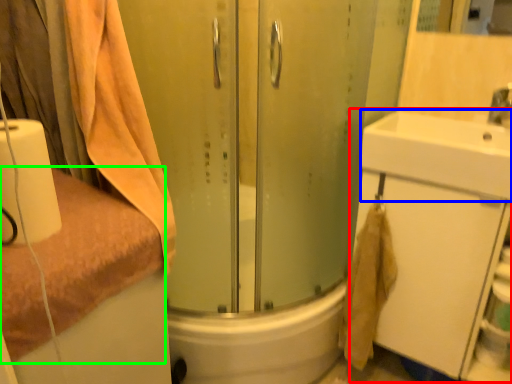
Question: Which is nearer to the bathroom cabinet (highlighted by a red box)? sink (highlighted by a blue box) or towel (highlighted by a green box).

Choices:
 (A) sink
 (B) towel

Answer: (A)